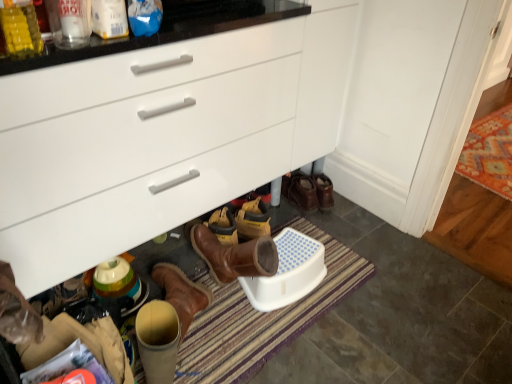
The width and height of the screenshot is (512, 384). I want to click on spots to the right of striped fabric bath mat at lower center, so click(x=392, y=319).